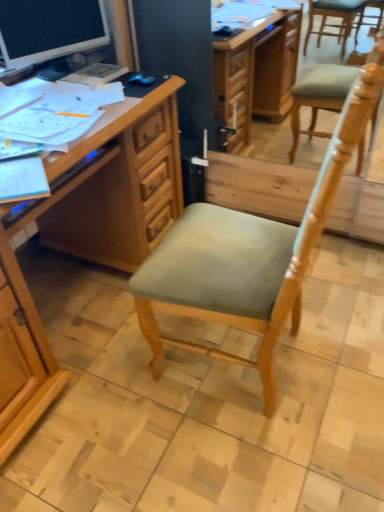
Question: From the image's perspective, is wooden desk at left located beneath light green fabric chair at center?

Choices:
 (A) yes
 (B) no

Answer: (B)

Question: Considering the relative sizes of wooden desk at left and light green fabric chair at center in the image provided, is wooden desk at left wider than light green fabric chair at center?

Choices:
 (A) yes
 (B) no

Answer: (A)

Question: Can you confirm if wooden desk at left is bigger than light green fabric chair at center?

Choices:
 (A) yes
 (B) no

Answer: (A)

Question: Can you confirm if wooden desk at left is shorter than light green fabric chair at center?

Choices:
 (A) no
 (B) yes

Answer: (B)

Question: Is wooden desk at left touching light green fabric chair at center?

Choices:
 (A) no
 (B) yes

Answer: (A)

Question: Is matte black monitor at upper left bigger or smaller than light green fabric chair at center?

Choices:
 (A) small
 (B) big

Answer: (A)

Question: In the image, is matte black monitor at upper left positioned in front of or behind light green fabric chair at center?

Choices:
 (A) front
 (B) behind

Answer: (B)

Question: Would you say matte black monitor at upper left is to the left or to the right of light green fabric chair at center in the picture?

Choices:
 (A) right
 (B) left

Answer: (B)

Question: From the image's perspective, is matte black monitor at upper left above or below light green fabric chair at center?

Choices:
 (A) below
 (B) above

Answer: (B)

Question: Choose the correct answer: Is wooden desk at left inside matte black monitor at upper left or outside it?

Choices:
 (A) outside
 (B) inside

Answer: (A)

Question: In terms of width, does wooden desk at left look wider or thinner when compared to matte black monitor at upper left?

Choices:
 (A) wide
 (B) thin

Answer: (A)

Question: From their relative heights in the image, would you say wooden desk at left is taller or shorter than matte black monitor at upper left?

Choices:
 (A) tall
 (B) short

Answer: (A)

Question: From the image's perspective, relative to matte black monitor at upper left, is wooden desk at left above or below?

Choices:
 (A) above
 (B) below

Answer: (B)

Question: Is wooden desk at left bigger or smaller than light green fabric chair at center?

Choices:
 (A) big
 (B) small

Answer: (A)

Question: Is wooden desk at left taller or shorter than light green fabric chair at center?

Choices:
 (A) tall
 (B) short

Answer: (B)